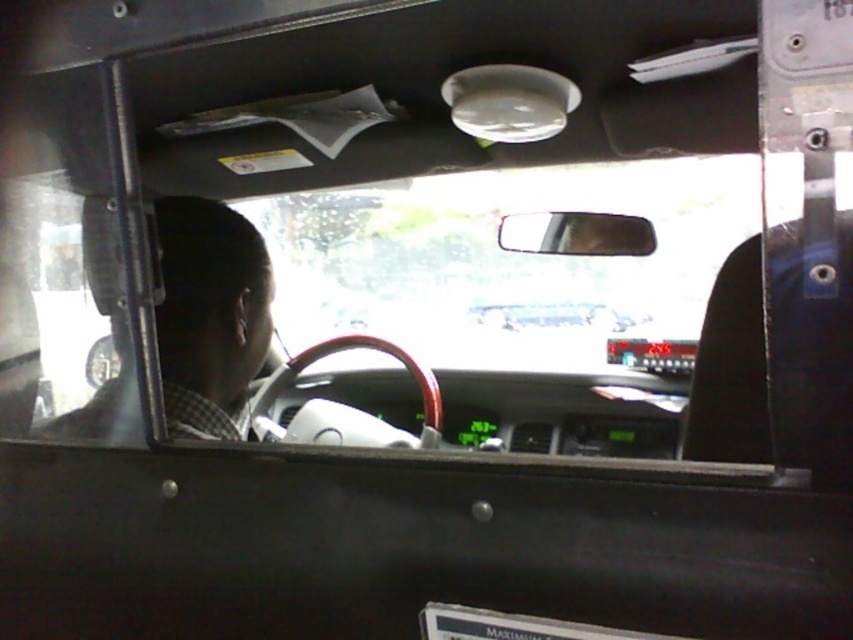
Question: Is dark gray checkered shirt at left behind white plastic license plate at center?

Choices:
 (A) yes
 (B) no

Answer: (A)

Question: Can you confirm if dark gray checkered shirt at left is thinner than white plastic license plate at center?

Choices:
 (A) no
 (B) yes

Answer: (A)

Question: Which object is farther from the camera taking this photo?

Choices:
 (A) dark gray checkered shirt at left
 (B) white plastic license plate at center

Answer: (A)

Question: Which object is closer to the camera taking this photo?

Choices:
 (A) white plastic license plate at center
 (B) dark gray checkered shirt at left

Answer: (A)

Question: Which point is closer to the camera?

Choices:
 (A) (498, 616)
 (B) (190, 314)

Answer: (A)

Question: Is dark gray checkered shirt at left below white plastic license plate at center?

Choices:
 (A) yes
 (B) no

Answer: (B)